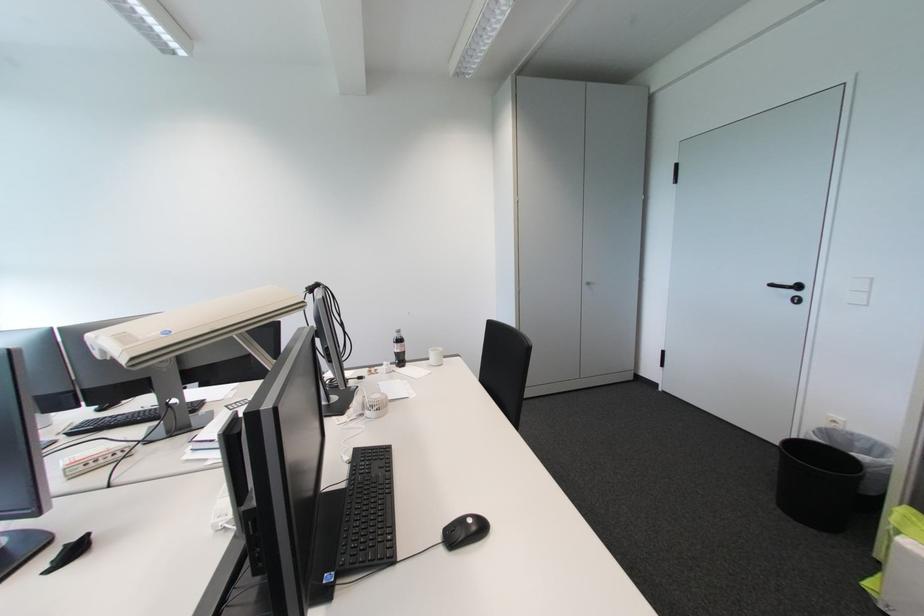
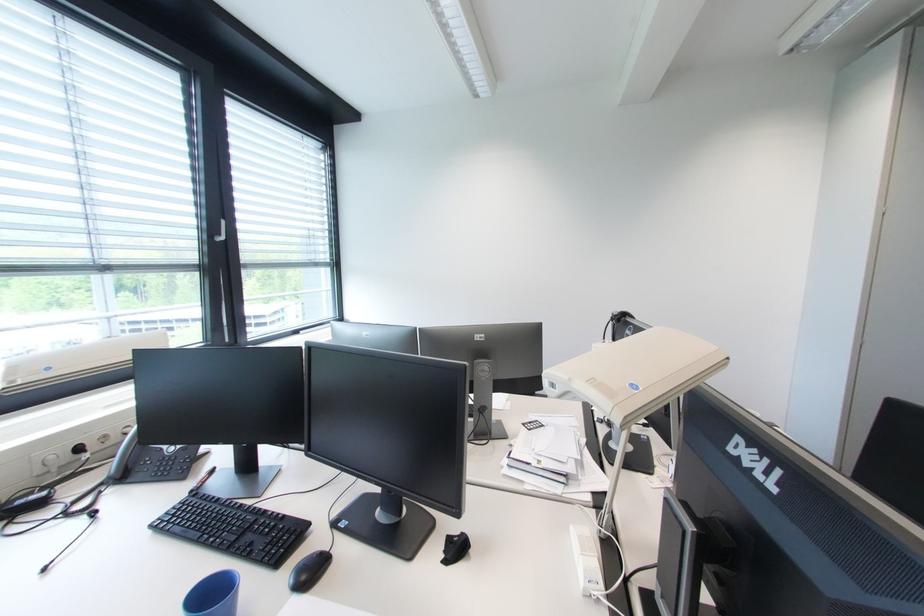
Where in the second image is the point corresponding to the point at 103,339 from the first image?

(577, 381)